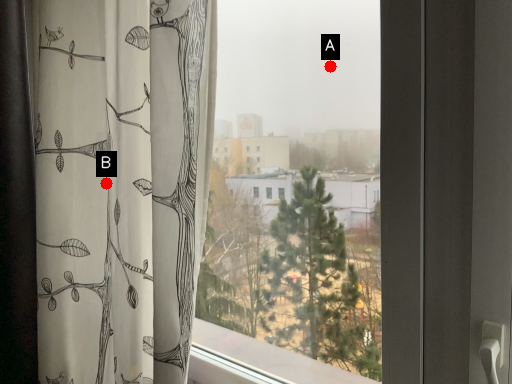
Question: Two points are circled on the image, labeled by A and B beside each circle. Among these points, which one is farthest from the camera?

Choices:
 (A) A is further
 (B) B is further

Answer: (B)